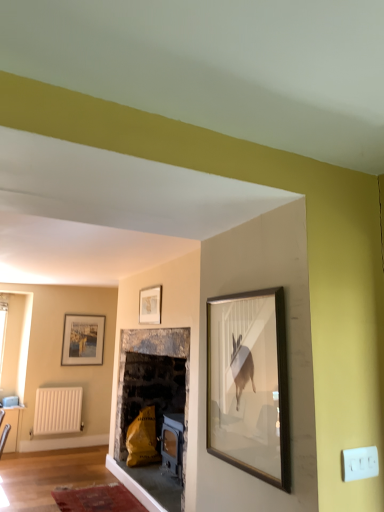
Question: Which direction should I rotate to look at wooden picture frame at upper center, which is counted as the second picture frame, starting from the left, — up or down?

Choices:
 (A) up
 (B) down

Answer: (B)

Question: Would you consider wooden picture frame at upper center, the first picture frame from the front, to be distant from matte white picture frame at left, acting as the 1th picture frame starting from the left?

Choices:
 (A) yes
 (B) no

Answer: (A)

Question: Considering the relative sizes of wooden picture frame at upper center, which is the 1th picture frame from right to left, and matte white picture frame at left, which is counted as the second picture frame, starting from the right, in the image provided, is wooden picture frame at upper center, which is the 1th picture frame from right to left, shorter than matte white picture frame at left, which is counted as the second picture frame, starting from the right,?

Choices:
 (A) no
 (B) yes

Answer: (B)

Question: From the image's perspective, is wooden picture frame at upper center, the second picture frame in the back-to-front sequence, on top of matte white picture frame at left, the second picture frame from the top?

Choices:
 (A) no
 (B) yes

Answer: (B)

Question: Does wooden picture frame at upper center, arranged as the second picture frame when ordered from the bottom, have a smaller size compared to matte white picture frame at left, the second picture frame from the top?

Choices:
 (A) no
 (B) yes

Answer: (B)

Question: Does wooden picture frame at upper center, arranged as the second picture frame when ordered from the bottom, lie in front of matte white picture frame at left, which appears as the 1th picture frame when viewed from the back?

Choices:
 (A) yes
 (B) no

Answer: (A)

Question: Is wooden picture frame at upper center, the first picture frame from the front, to the right of matte white picture frame at left, the 2th picture frame positioned from the front, from the viewer's perspective?

Choices:
 (A) yes
 (B) no

Answer: (A)

Question: Does matte white picture frame at left, the second picture frame from the top, have a smaller size compared to white matte radiator at lower left?

Choices:
 (A) no
 (B) yes

Answer: (B)

Question: Are matte white picture frame at left, which is counted as the 1th picture frame, starting from the bottom, and white matte radiator at lower left far apart?

Choices:
 (A) no
 (B) yes

Answer: (A)

Question: Can you confirm if matte white picture frame at left, acting as the 1th picture frame starting from the left, is positioned to the right of white matte radiator at lower left?

Choices:
 (A) yes
 (B) no

Answer: (A)

Question: From the image's perspective, is matte white picture frame at left, which appears as the 1th picture frame when viewed from the back, located beneath white matte radiator at lower left?

Choices:
 (A) no
 (B) yes

Answer: (A)

Question: Can we say matte white picture frame at left, which is counted as the second picture frame, starting from the right, lies outside white matte radiator at lower left?

Choices:
 (A) no
 (B) yes

Answer: (B)

Question: Is matte white picture frame at left, the second picture frame from the top, positioned behind white matte radiator at lower left?

Choices:
 (A) no
 (B) yes

Answer: (B)

Question: Does wooden picture frame at upper center, the second picture frame in the back-to-front sequence, have a larger size compared to white matte radiator at lower left?

Choices:
 (A) yes
 (B) no

Answer: (B)